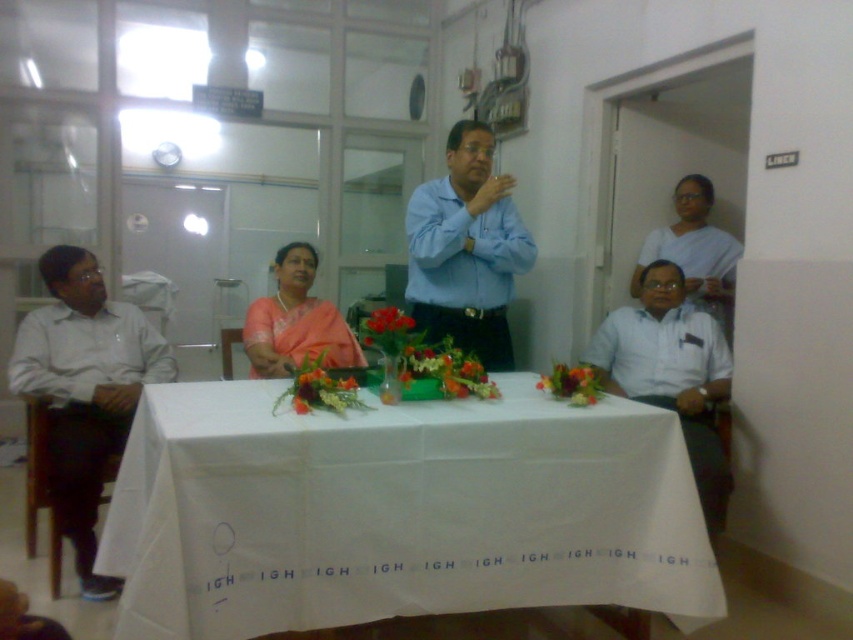
You are organizing a photo shoot and need to ensure that the white shirt at right and the floral arrangement at center are both visible in the frame. Based on their sizes, which object should you prioritize positioning closer to the camera to ensure clarity?

The white shirt at right is larger in width than the floral arrangement at center, so you should prioritize positioning the white shirt at right closer to the camera to ensure clarity.

You are sitting at the table and want to pass a document to the person wearing the white shirt at left and the person wearing the satin pink saree at center. Which direction should you move the document first?

The white shirt at left is to the left of the satin pink saree at center, so you should first move the document to the left towards the white shirt at left.